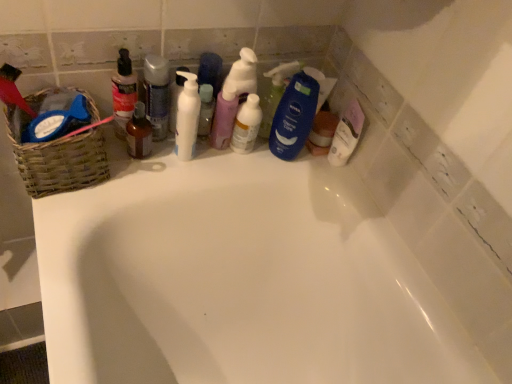
Locate an element on the screen. vacant space that is to the left of blue matte bottle at center, the 4th cleaning product when ordered from left to right is located at coordinates (215, 153).